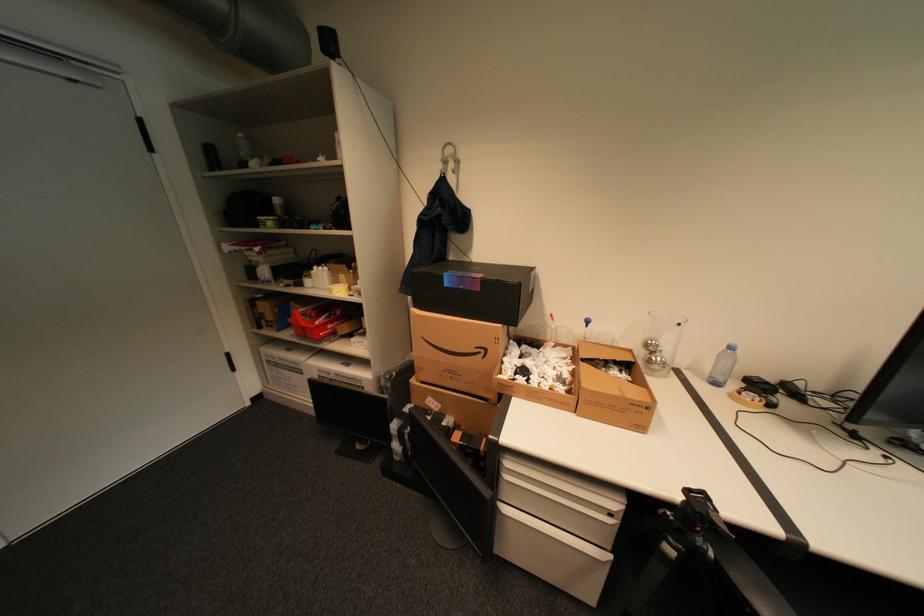
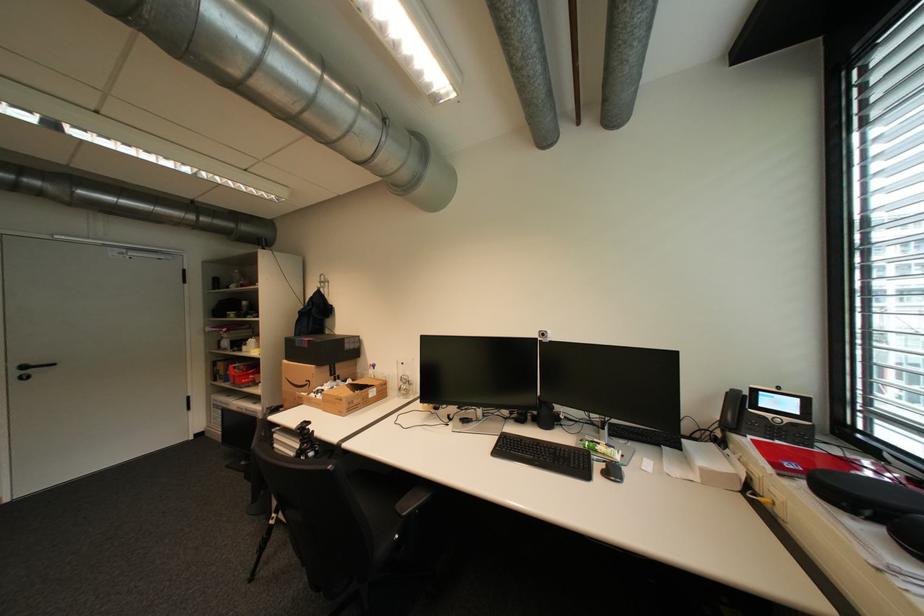
In the second image, find the point that corresponds to the point at 469,286 in the first image.

(310, 346)